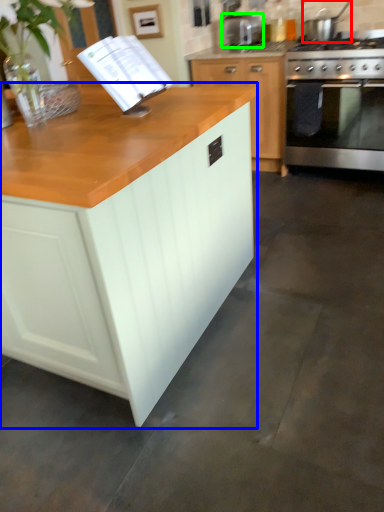
Question: Considering the real-world distances, which object is closest to kitchen appliance (highlighted by a red box)? cabinetry (highlighted by a blue box) or appliance (highlighted by a green box).

Choices:
 (A) cabinetry
 (B) appliance

Answer: (B)